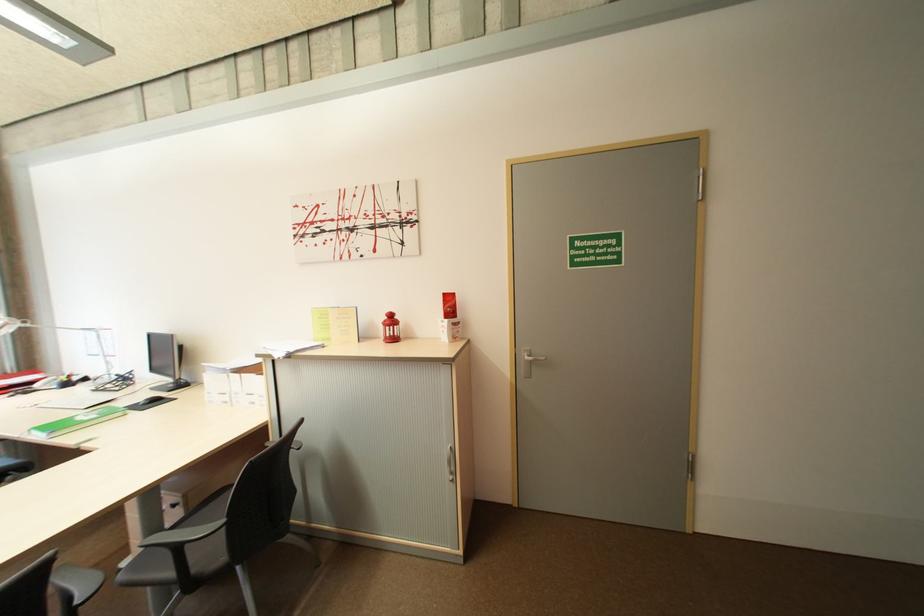
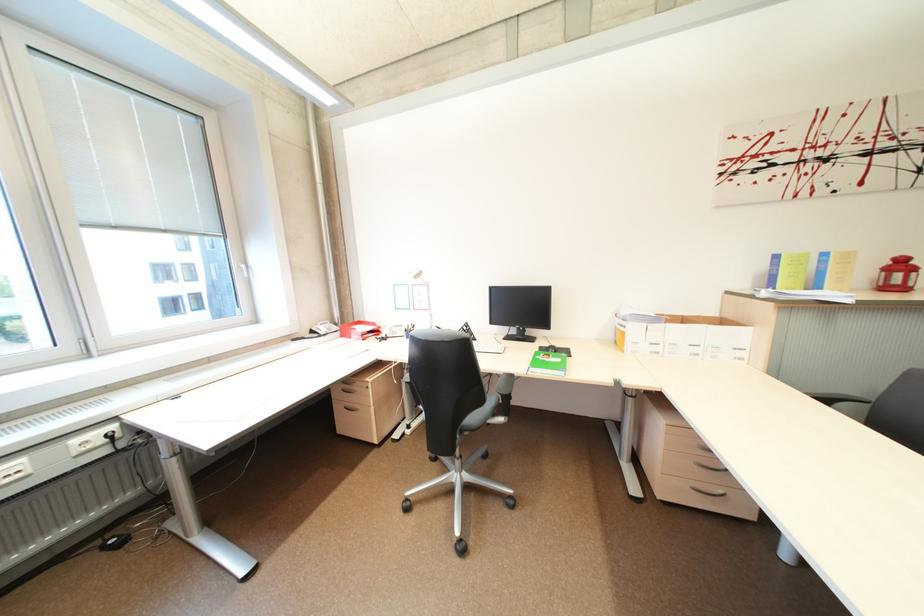
In the second image, find the point that corresponds to point 400,321 in the first image.

(910, 265)